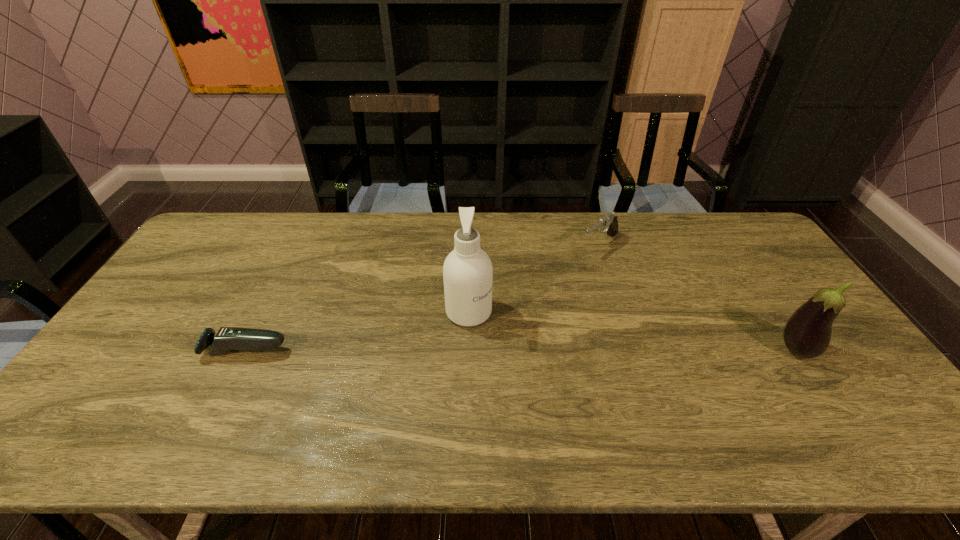
Where is `free space on the desktop that is between the shortest object and the rightmost object and is positioned at the muzzle of the gun`? The image size is (960, 540). free space on the desktop that is between the shortest object and the rightmost object and is positioned at the muzzle of the gun is located at coordinates (468, 350).

Locate an element on the screen. The width and height of the screenshot is (960, 540). vacant space on the desktop that is between the electric shaver and the eggplant and is positioned on the front label of the cleansing agent is located at coordinates (534, 350).